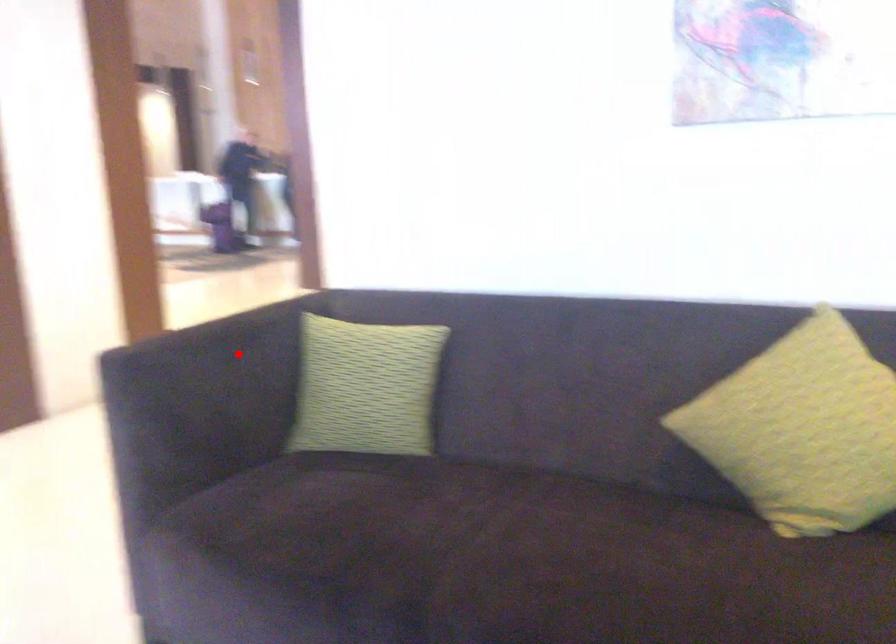
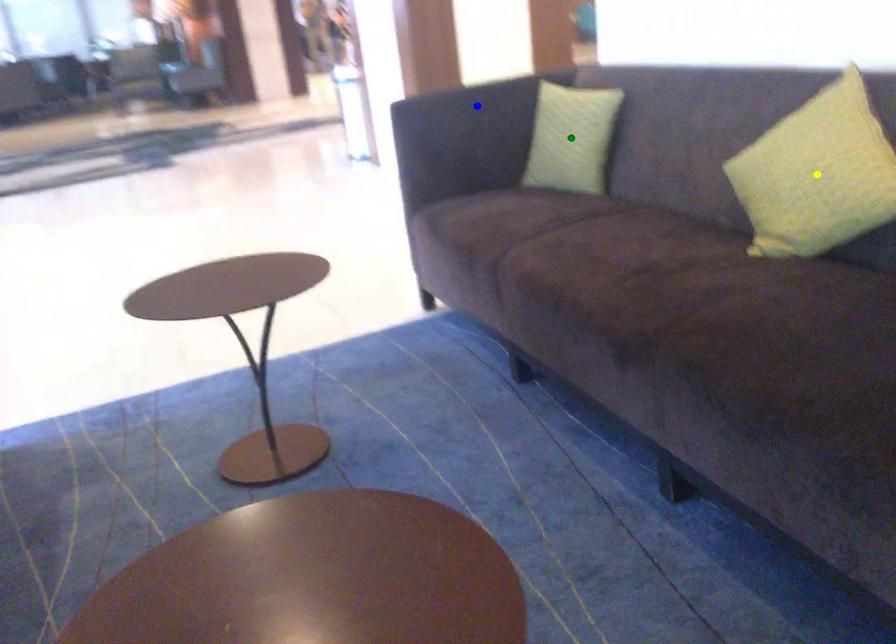
Question: I am providing you with two images of the same scene from different viewpoints. A red point is marked on the first image. You are given multiple points on the second image. Can you choose the point in image 2 that corresponds to the point in image 1?

Choices:
 (A) blue point
 (B) yellow point
 (C) green point

Answer: (A)